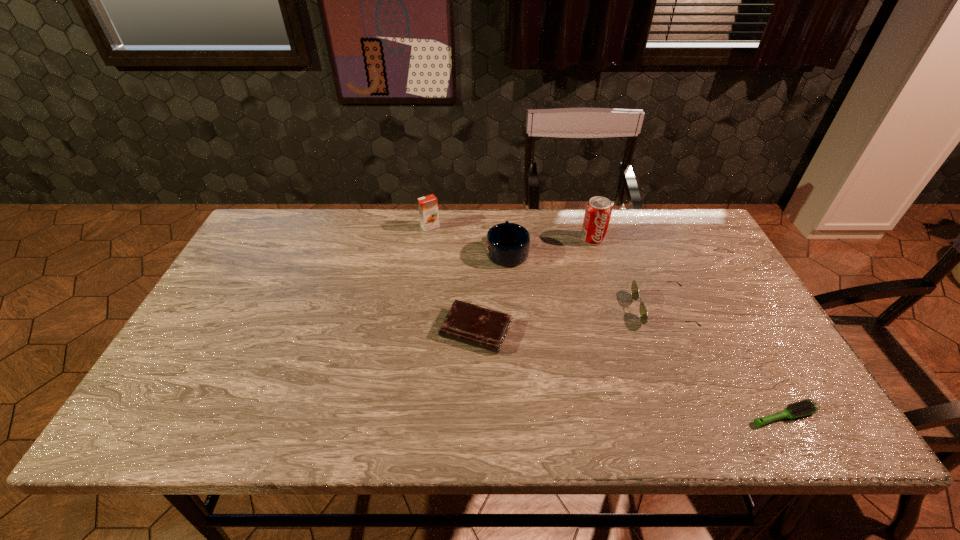
The width and height of the screenshot is (960, 540). Find the location of `vacant area at the near left corner of the desktop`. vacant area at the near left corner of the desktop is located at coordinates pyautogui.click(x=202, y=436).

Locate an element on the screen. The width and height of the screenshot is (960, 540). free point at the far right corner is located at coordinates (655, 226).

Locate an element on the screen. Image resolution: width=960 pixels, height=540 pixels. unoccupied area between the mug and the soda can is located at coordinates (550, 245).

Identify the location of vacant point located between the shortest object and the diary. (630, 373).

At what (x,y) coordinates should I click in order to perform the action: click on unoccupied area between the third shortest object and the orange juice. Please return your answer as a coordinate pair (x, y). The width and height of the screenshot is (960, 540). Looking at the image, I should click on (546, 268).

Image resolution: width=960 pixels, height=540 pixels. What are the coordinates of `vacant area between the soda can and the diary` in the screenshot? It's located at (534, 285).

The image size is (960, 540). I want to click on vacant point located between the diary and the fourth tallest object, so click(x=569, y=320).

Locate an element on the screen. Image resolution: width=960 pixels, height=540 pixels. empty location between the third object from right to left and the third tallest object is located at coordinates (550, 245).

In order to click on blank region between the soda can and the second object from right to left in this screenshot , I will do `click(628, 274)`.

You are a GUI agent. You are given a task and a screenshot of the screen. Output one action in this format:
    pyautogui.click(x=<x>, y=<y>)
    Task: Click on the free space between the fifth object from left to right and the diary
    The image size is (960, 540).
    Given the screenshot: What is the action you would take?
    pyautogui.click(x=569, y=320)